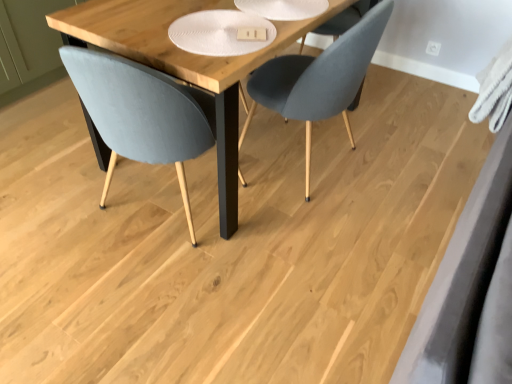
This screenshot has height=384, width=512. In order to click on vacant area that lies between velvet grey chair at center, the first chair in the right-to-left sequence, and wooden table at center in this screenshot , I will do (x=311, y=184).